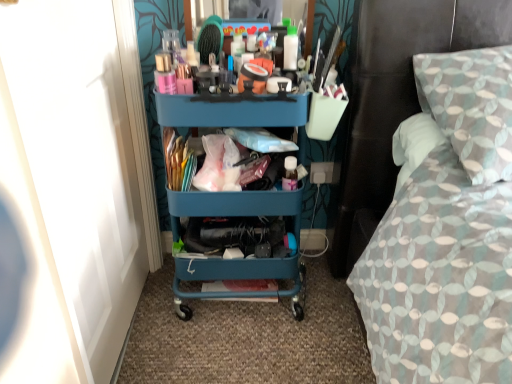
Question: Is textured fabric bed at right in front of or behind white plastic power outlet at lower right in the image?

Choices:
 (A) behind
 (B) front

Answer: (B)

Question: In the image, is textured fabric bed at right on the left side or the right side of white plastic power outlet at lower right?

Choices:
 (A) left
 (B) right

Answer: (B)

Question: Considering the real-world distances, which object is farthest from the teal plastic cart at center?

Choices:
 (A) white plastic power outlet at lower right
 (B) textured fabric bed at right

Answer: (A)

Question: Which object is the closest to the textured fabric bed at right?

Choices:
 (A) white plastic power outlet at lower right
 (B) teal plastic cart at center

Answer: (B)